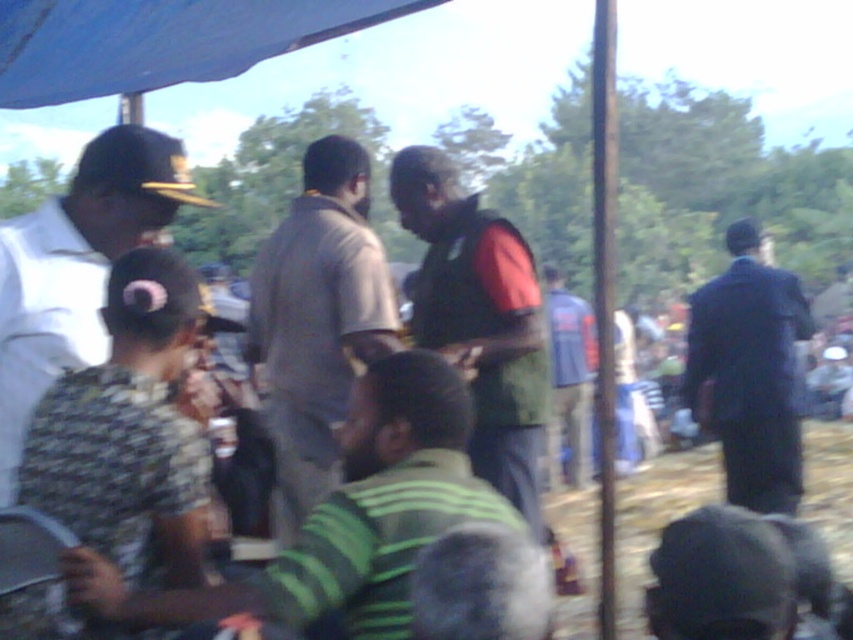
You are at the event and want to find the dark blue suit at right. Where should you look relative to the blue fabric shirt at center?

The dark blue suit at right is located to the right of the blue fabric shirt at center, so you should look to the right side of the blue fabric shirt at center to find it.

You are a photographer at the event and want to capture both the point at (47, 289) and the point at (549, 269) in your photo. Which point will appear larger in the photo?

Point at (47, 289) will appear larger in the photo because it is closer to the camera than point at (549, 269).

Looking at this image, you are organizing a game that requires participants to stand in a straight line. You need to ensure there is enough space between the camouflage shirt at left and the blue fabric shirt at center. The minimum required distance between participants is 2 meters. Can the participants stand at these positions without violating the distance rule?

The camouflage shirt at left is 5.46 meters from the blue fabric shirt at center. Since the minimum required distance is 2 meters, the participants can stand at these positions without violating the distance rule as the distance is sufficient.